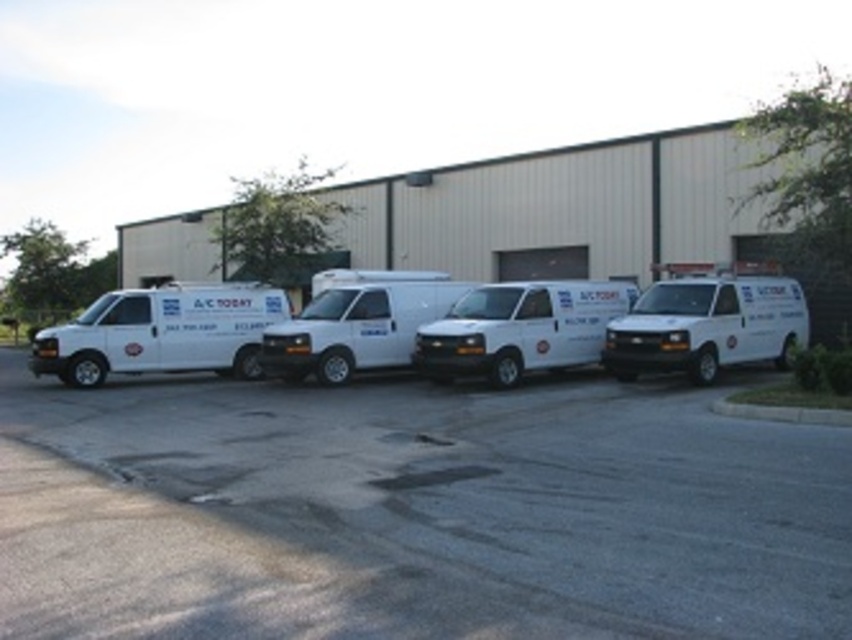
Question: Is white matte van at left to the left of white matte van at center from the viewer's perspective?

Choices:
 (A) no
 (B) yes

Answer: (B)

Question: Which point is closer to the camera?

Choices:
 (A) white matte van at right
 (B) white matte van at left
 (C) white glossy van at center

Answer: (A)

Question: Estimate the real-world distances between objects in this image. Which object is closer to the white matte van at left?

Choices:
 (A) white matte van at right
 (B) white glossy van at center
 (C) white asphalt parking lot at center
 (D) white matte van at center

Answer: (B)

Question: Which of the following is the closest to the observer?

Choices:
 (A) white matte van at right
 (B) white matte van at left
 (C) white matte van at center

Answer: (C)

Question: Is white matte van at left below white glossy van at center?

Choices:
 (A) yes
 (B) no

Answer: (A)

Question: Is white asphalt parking lot at center above white matte van at center?

Choices:
 (A) yes
 (B) no

Answer: (B)